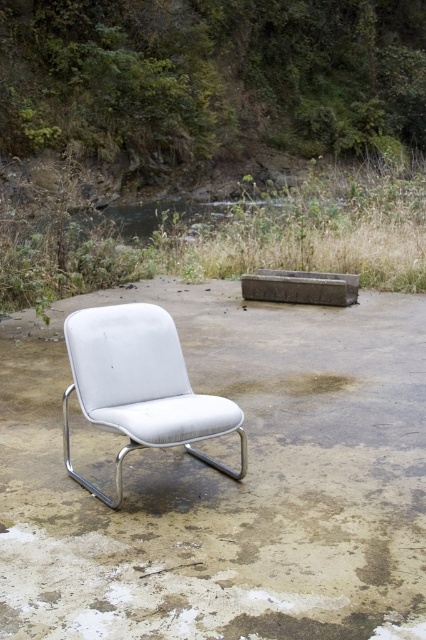
Can you confirm if white leather chair at center is positioned to the right of white fabric chair at center?

Correct, you'll find white leather chair at center to the right of white fabric chair at center.

Does white leather chair at center have a lesser width compared to white fabric chair at center?

In fact, white leather chair at center might be wider than white fabric chair at center.

Between point (370, 424) and point (132, 365), which one is positioned in front?

Positioned in front is point (132, 365).

In order to click on white leather chair at center in this screenshot , I will do `click(229, 481)`.

From the picture: Who is positioned more to the left, white fabric chair at center or brown dirt at center?

brown dirt at center

Can you confirm if white fabric chair at center is bigger than brown dirt at center?

Actually, white fabric chair at center might be smaller than brown dirt at center.

I want to click on white fabric chair at center, so click(x=140, y=387).

Is white leather chair at center smaller than brown dirt at center?

Indeed, white leather chair at center has a smaller size compared to brown dirt at center.

Can you confirm if white leather chair at center is positioned below brown dirt at center?

Yes, white leather chair at center is below brown dirt at center.

Is point (374, 548) positioned behind point (199, 220)?

No.

The image size is (426, 640). Find the location of `white leather chair at center`. white leather chair at center is located at coordinates (229, 481).